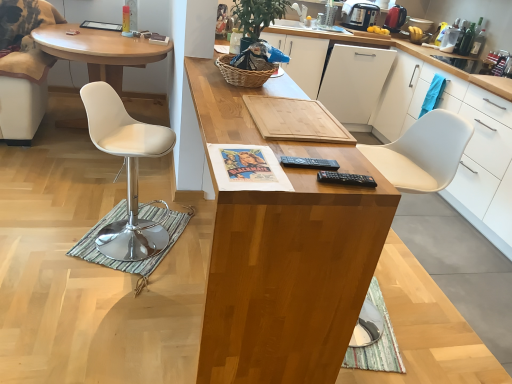
Question: Visually, is white matte dishwasher at center positioned to the left or to the right of metallic silver coffee maker at upper right?

Choices:
 (A) right
 (B) left

Answer: (B)

Question: Is point (376, 62) closer or farther from the camera than point (364, 13)?

Choices:
 (A) closer
 (B) farther

Answer: (A)

Question: Based on their relative distances, which object is farther from the green striped mat at lower left?

Choices:
 (A) white leather desk at left, the 1th desk viewed from the left
 (B) white leather chair at left
 (C) metallic silver coffee maker at upper right
 (D) wooden at center, marked as the 1th desk in a front-to-back arrangement
 (E) white matte dishwasher at center

Answer: (C)

Question: Based on their relative distances, which object is nearer to the black plastic remote control at right, marked as the first remote control in a bottom-to-top arrangement?

Choices:
 (A) wooden cutting board at center, which is the 1th cabinetry from left to right
 (B) green striped mat at lower left
 (C) green woven basket at upper center
 (D) white matte dishwasher at center
 (E) white matte cabinet at right, the 1th cabinetry viewed from the right

Answer: (C)